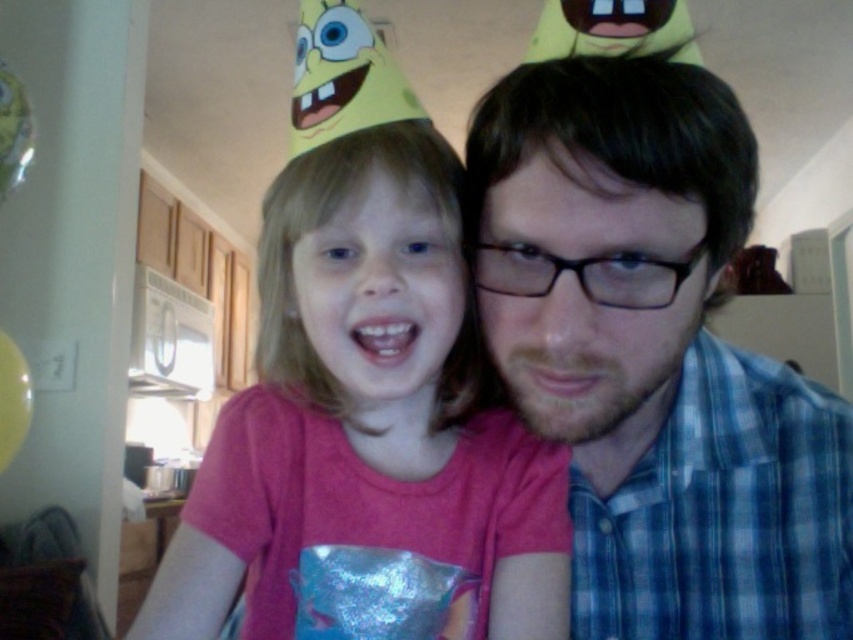
Question: Is blue plaid shirt at center below pink matte shirt at center?

Choices:
 (A) no
 (B) yes

Answer: (B)

Question: Is blue plaid shirt at center to the right of pink matte shirt at center from the viewer's perspective?

Choices:
 (A) yes
 (B) no

Answer: (A)

Question: In this image, where is blue plaid shirt at center located relative to pink matte shirt at center?

Choices:
 (A) left
 (B) right

Answer: (B)

Question: Which point is closer to the camera taking this photo?

Choices:
 (A) (701, 200)
 (B) (271, 291)

Answer: (A)

Question: Which of the following is the farthest from the observer?

Choices:
 (A) blue plaid shirt at center
 (B) pink matte shirt at center

Answer: (B)